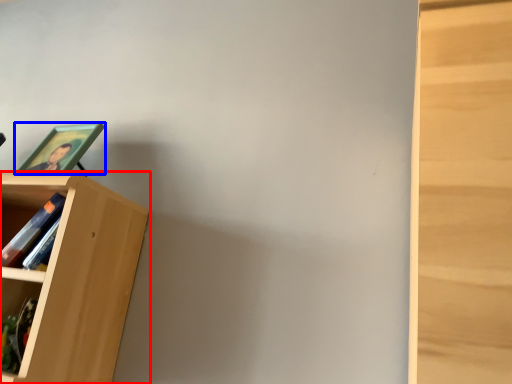
Question: Which object appears farthest to the camera in this image, bookcase (highlighted by a red box) or picture frame (highlighted by a blue box)?

Choices:
 (A) bookcase
 (B) picture frame

Answer: (B)